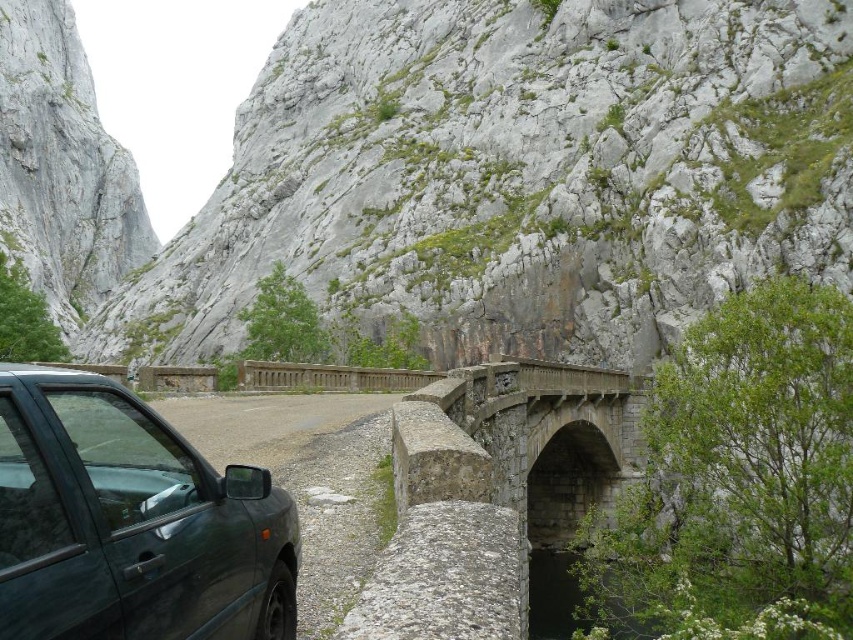
You are standing at the center of the stone bridge in the image. Looking towards the dark green matte car at lower left, in which direction should you walk to reach it?

You should walk towards the lower left direction to reach the dark green matte car at lower left since it is located at point (131, 522).

You are a hiker standing on the gravel path near the dark car. You want to take a photo of the stone arch bridge at center with the gray rock wall at upper center in the background. Can you position yourself so that both are fully visible in the frame without any obstruction?

The gray rock wall at upper center is to the left of the stone arch bridge at center, so if you move to the right side of the gravel path away from the dark car, you can position yourself where the bridge is centered and the rock wall remains visible in the background without obstruction.